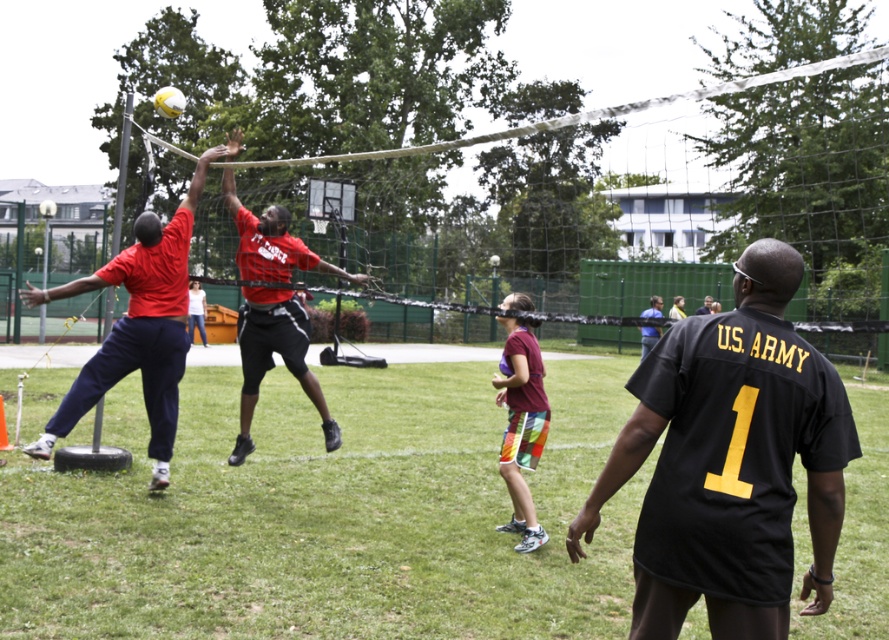
Question: Is white mesh net at center in front of black jersey at center?

Choices:
 (A) yes
 (B) no

Answer: (A)

Question: Observing the image, what is the correct spatial positioning of yellow matte volleyball at upper center in reference to black jersey at center?

Choices:
 (A) below
 (B) above

Answer: (B)

Question: Which point is farther from the camera taking this photo?

Choices:
 (A) (707, 307)
 (B) (517, 531)
 (C) (311, 157)
 (D) (153, 241)

Answer: (A)

Question: Which point is closer to the camera?

Choices:
 (A) black jersey at center
 (B) maroon fabric shorts at center

Answer: (B)

Question: Which point is farther to the camera?

Choices:
 (A) maroon fabric shorts at center
 (B) red matte shirt at center
 (C) black jersey at center
 (D) matte red shirt at center

Answer: (C)

Question: Is matte red shirt at center wider than yellow matte volleyball at upper center?

Choices:
 (A) no
 (B) yes

Answer: (A)